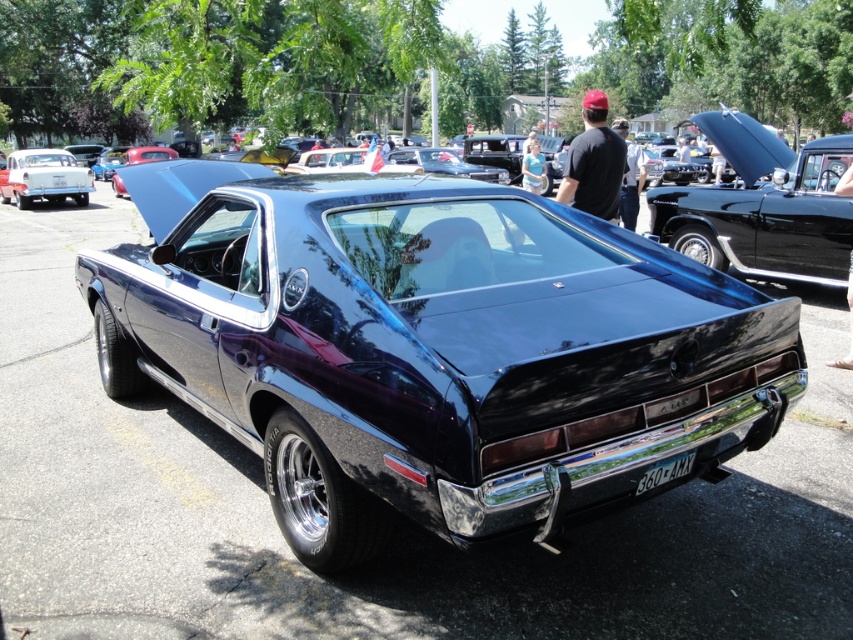
Who is positioned more to the left, glossy black car at upper right or white plastic license plate at center?

From the viewer's perspective, white plastic license plate at center appears more on the left side.

Between point (796, 202) and point (686, 454), which one is positioned in front?

Point (686, 454)

This screenshot has height=640, width=853. Identify the location of glossy black car at upper right. (762, 205).

Who is more distant from viewer, (718, 205) or (622, 221)?

The point (622, 221) is behind.

Can you confirm if glossy black car at upper right is thinner than matte black shirt at center?

Indeed, glossy black car at upper right has a lesser width compared to matte black shirt at center.

Measure the distance between glossy black car at upper right and camera.

They are 7.30 meters apart.

Image resolution: width=853 pixels, height=640 pixels. In order to click on glossy black car at upper right in this screenshot , I will do `click(762, 205)`.

Does glossy black muscle car at center have a larger size compared to black matte shirt at upper center?

Correct, glossy black muscle car at center is larger in size than black matte shirt at upper center.

Which of these two, glossy black muscle car at center or black matte shirt at upper center, stands taller?

glossy black muscle car at center is taller.

At what (x,y) coordinates should I click in order to perform the action: click on glossy black muscle car at center. Please return your answer as a coordinate pair (x, y). Looking at the image, I should click on (438, 353).

At what (x,y) coordinates should I click in order to perform the action: click on glossy black muscle car at center. Please return your answer as a coordinate pair (x, y). This screenshot has width=853, height=640. Looking at the image, I should click on (438, 353).